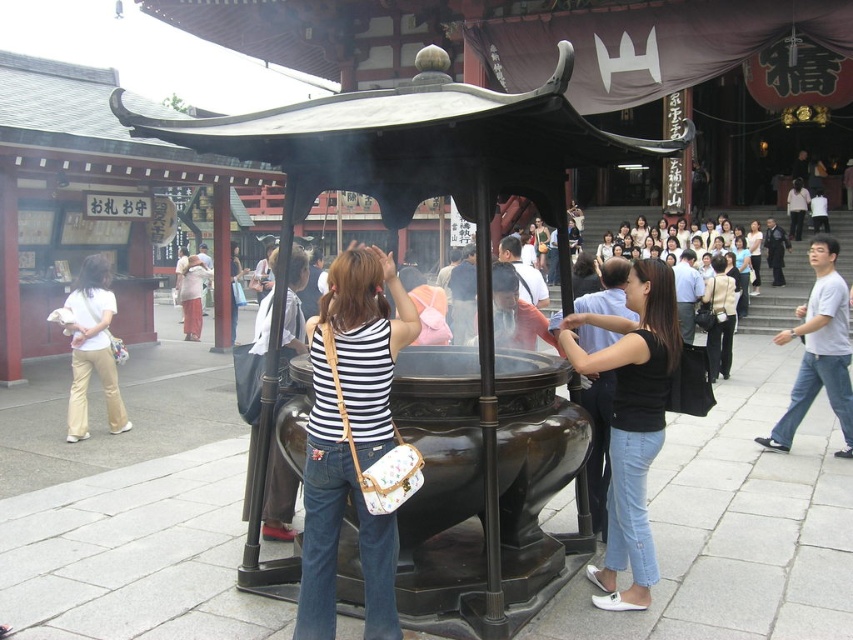
Can you confirm if striped fabric shirt at center is bigger than matte beige pants at lower left?

No.

Does striped fabric shirt at center have a greater height compared to matte beige pants at lower left?

Correct, striped fabric shirt at center is much taller as matte beige pants at lower left.

Is point (316, 564) closer to viewer compared to point (68, 307)?

Yes, point (316, 564) is in front of point (68, 307).

Where is `striped fabric shirt at center`? The height and width of the screenshot is (640, 853). striped fabric shirt at center is located at coordinates (352, 438).

Which of these two, matte beige pants at lower left or dark gray pants at center, stands taller?

Standing taller between the two is dark gray pants at center.

Between point (90, 333) and point (796, 216), which one is positioned behind?

The point (796, 216) is behind.

The height and width of the screenshot is (640, 853). Find the location of `matte beige pants at lower left`. matte beige pants at lower left is located at coordinates (91, 348).

From the picture: Is striped fabric shirt at center bigger than dark gray pants at center?

No.

Does striped fabric shirt at center appear on the right side of dark gray pants at center?

No, striped fabric shirt at center is not to the right of dark gray pants at center.

Measure the distance between striped fabric shirt at center and camera.

4.32 meters

In order to click on striped fabric shirt at center in this screenshot , I will do `click(352, 438)`.